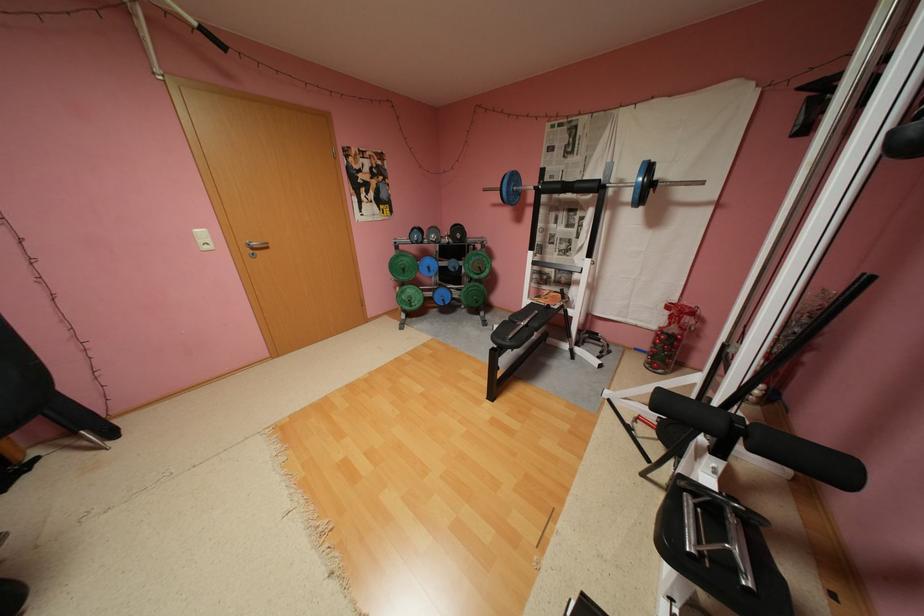
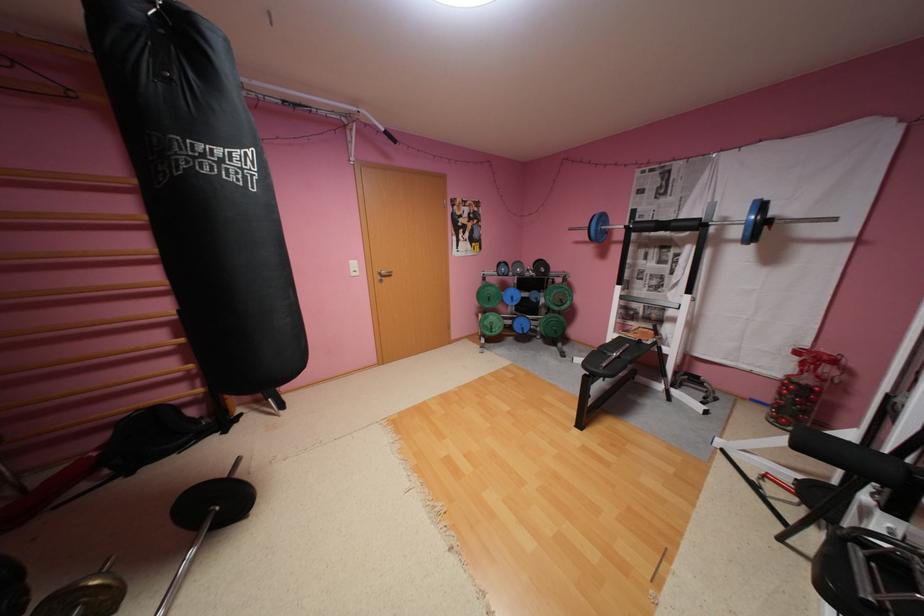
Question: The first image is from the beginning of the video and the second image is from the end. How did the camera likely rotate when shooting the video?

Choices:
 (A) Left
 (B) Right
 (C) Up
 (D) Down

Answer: (A)